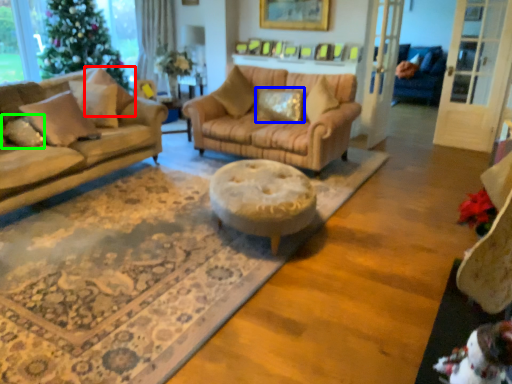
Question: Considering the real-world distances, which object is farthest from pillow (highlighted by a red box)? pillow (highlighted by a blue box) or pillow (highlighted by a green box)?

Choices:
 (A) pillow
 (B) pillow

Answer: (A)